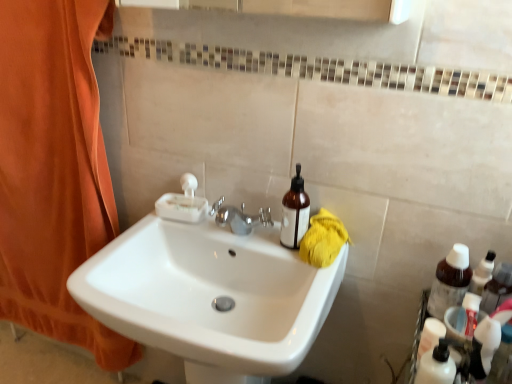
Question: From the image's perspective, does brown translucent bottle at right appear higher than white glossy sink at center?

Choices:
 (A) yes
 (B) no

Answer: (A)

Question: From a real-world perspective, is brown translucent bottle at right below white glossy sink at center?

Choices:
 (A) yes
 (B) no

Answer: (B)

Question: Is brown translucent bottle at right to the right of white glossy sink at center from the viewer's perspective?

Choices:
 (A) yes
 (B) no

Answer: (A)

Question: From a real-world perspective, is brown translucent bottle at right located higher than white glossy sink at center?

Choices:
 (A) no
 (B) yes

Answer: (B)

Question: Can you confirm if brown translucent bottle at right is thinner than white glossy sink at center?

Choices:
 (A) yes
 (B) no

Answer: (A)

Question: In the image, is brown glass bottle at right positioned in front of or behind brown translucent bottle at right?

Choices:
 (A) front
 (B) behind

Answer: (B)

Question: From a real-world perspective, is brown glass bottle at right physically located above or below brown translucent bottle at right?

Choices:
 (A) below
 (B) above

Answer: (B)

Question: From the image's perspective, is brown glass bottle at right above or below brown translucent bottle at right?

Choices:
 (A) below
 (B) above

Answer: (B)

Question: Is brown glass bottle at right spatially inside brown translucent bottle at right, or outside of it?

Choices:
 (A) inside
 (B) outside

Answer: (B)

Question: Is point (195, 342) positioned closer to the camera than point (430, 362)?

Choices:
 (A) closer
 (B) farther

Answer: (A)

Question: Based on their sizes in the image, would you say white glossy sink at center is bigger or smaller than white plastic pump bottle at lower right?

Choices:
 (A) small
 (B) big

Answer: (B)

Question: Considering the relative positions of white glossy sink at center and white plastic pump bottle at lower right in the image provided, is white glossy sink at center to the left or to the right of white plastic pump bottle at lower right?

Choices:
 (A) left
 (B) right

Answer: (A)

Question: Is white glossy sink at center spatially inside white plastic pump bottle at lower right, or outside of it?

Choices:
 (A) outside
 (B) inside

Answer: (A)

Question: Is brown translucent bottle at right situated inside white glossy sink at center or outside?

Choices:
 (A) outside
 (B) inside

Answer: (A)

Question: Considering the relative positions of brown translucent bottle at right and white glossy sink at center in the image provided, is brown translucent bottle at right to the left or to the right of white glossy sink at center?

Choices:
 (A) right
 (B) left

Answer: (A)